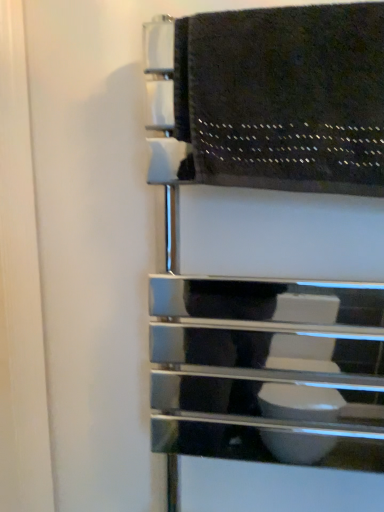
At what (x,y) coordinates should I click in order to perform the action: click on black textured towel at upper center. Please return your answer as a coordinate pair (x, y). Image resolution: width=384 pixels, height=512 pixels. Looking at the image, I should click on (283, 98).

Describe the element at coordinates (283, 98) in the screenshot. This screenshot has height=512, width=384. I see `black textured towel at upper center` at that location.

Measure the distance between point (241, 125) and camera.

The depth of point (241, 125) is 22.17 inches.

Find the location of a particular element. black textured towel at upper center is located at coordinates (283, 98).